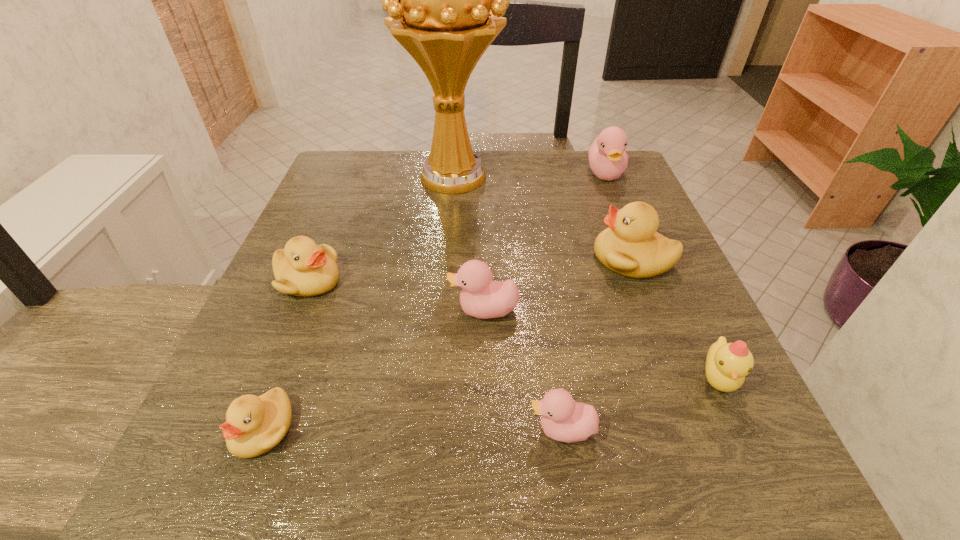
Identify the location of trophy_cup. Image resolution: width=960 pixels, height=540 pixels. (445, 0).

Where is `the tallest object`? The height and width of the screenshot is (540, 960). the tallest object is located at coordinates (445, 0).

The height and width of the screenshot is (540, 960). I want to click on the biggest pink duckling, so click(608, 159).

Locate an element on the screen. Image resolution: width=960 pixels, height=540 pixels. the farthest duckling is located at coordinates (608, 159).

Identify the location of the biggest yellow duckling. This screenshot has height=540, width=960. (631, 247).

This screenshot has width=960, height=540. In order to click on the second biggest pink duckling in this screenshot , I will do `click(480, 297)`.

You are a GUI agent. You are given a task and a screenshot of the screen. Output one action in this format:
    pyautogui.click(x=<x>, y=<y>)
    Task: Click on the smallest pink duckling
    The height and width of the screenshot is (540, 960).
    Given the screenshot: What is the action you would take?
    pyautogui.click(x=564, y=420)

Locate an element on the screen. This screenshot has width=960, height=540. the smallest yellow duckling is located at coordinates (254, 425).

Identify the location of blank space located at the front of the trophy_cup where the globe is prominent. The height and width of the screenshot is (540, 960). (444, 283).

I want to click on free space located 0.350m on the front-facing side of the farthest pink duckling, so click(x=655, y=297).